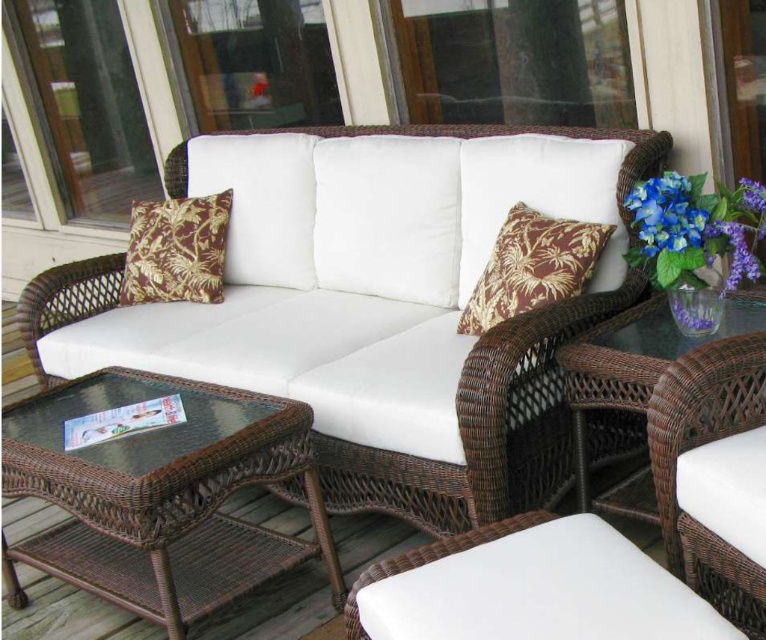
You are a delivery person trying to place a large package on the woven rattan couch at center and the brown textured pillow at center. Which object should you avoid placing the package on to ensure it doesn not fall off?

You should avoid placing the package on the brown textured pillow at center because the woven rattan couch at center is taller than the brown textured pillow at center, making the pillow a less stable surface.